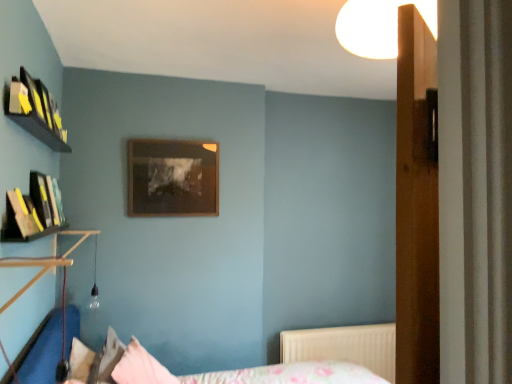
Describe the element at coordinates (292, 374) in the screenshot. This screenshot has height=384, width=512. I see `floral fabric bed at lower center` at that location.

The height and width of the screenshot is (384, 512). What do you see at coordinates (377, 26) in the screenshot?
I see `white glossy light fixture at upper center` at bounding box center [377, 26].

What do you see at coordinates (140, 367) in the screenshot?
I see `pink fabric pillow at lower center, the 2th pillow in the left-to-right sequence` at bounding box center [140, 367].

This screenshot has width=512, height=384. What do you see at coordinates (80, 363) in the screenshot?
I see `fluffy pink pillow at lower left, the 1th pillow when ordered from left to right` at bounding box center [80, 363].

What is the approximate width of yellow paper at upper left?

It is 3.23 inches.

Locate an element on the screen. The width and height of the screenshot is (512, 384). floral fabric bed at lower center is located at coordinates (292, 374).

From the picture: Considering the relative sizes of white glossy light fixture at upper center and pink fabric pillow at lower center, which appears as the 1th pillow when viewed from the right, in the image provided, is white glossy light fixture at upper center taller than pink fabric pillow at lower center, which appears as the 1th pillow when viewed from the right,?

In fact, white glossy light fixture at upper center may be shorter than pink fabric pillow at lower center, which appears as the 1th pillow when viewed from the right.

Which is nearer, (389, 33) or (154, 373)?

Point (389, 33).

Is pink fabric pillow at lower center, which appears as the 1th pillow when viewed from the right, at the back of white glossy light fixture at upper center?

No, white glossy light fixture at upper center is not facing away from pink fabric pillow at lower center, which appears as the 1th pillow when viewed from the right.

Which object is positioned more to the right, white glossy light fixture at upper center or pink fabric pillow at lower center, the 2th pillow in the left-to-right sequence?

white glossy light fixture at upper center.

From the image's perspective, is white glossy light fixture at upper center on top of white textured radiator at lower right?

Yes, from the image's perspective, white glossy light fixture at upper center is on top of white textured radiator at lower right.

Does white glossy light fixture at upper center appear on the right side of white textured radiator at lower right?

No, white glossy light fixture at upper center is not to the right of white textured radiator at lower right.

In terms of size, does white glossy light fixture at upper center appear bigger or smaller than white textured radiator at lower right?

white glossy light fixture at upper center is smaller than white textured radiator at lower right.

Is white glossy light fixture at upper center shorter than white textured radiator at lower right?

Correct, white glossy light fixture at upper center is not as tall as white textured radiator at lower right.

Find the location of a particular element. This screenshot has height=384, width=512. light fixture above the yellow paper at upper left (from a real-world perspective) is located at coordinates 377,26.

Could you tell me if yellow paper at upper left is turned towards white glossy light fixture at upper center?

No, yellow paper at upper left does not turn towards white glossy light fixture at upper center.

Considering the relative sizes of yellow paper at upper left and white glossy light fixture at upper center in the image provided, is yellow paper at upper left smaller than white glossy light fixture at upper center?

Yes.

Is yellow paper at upper left positioned far away from white glossy light fixture at upper center?

Indeed, yellow paper at upper left is not near white glossy light fixture at upper center.

Would you say yellow paper at upper left is a long distance from wooden picture frame at center?

Absolutely, yellow paper at upper left is distant from wooden picture frame at center.

Locate an element on the screen. Image resolution: width=512 pixels, height=384 pixels. book above the wooden picture frame at center (from a real-world perspective) is located at coordinates (19, 98).

Is yellow paper at upper left looking in the opposite direction of wooden picture frame at center?

No, yellow paper at upper left is not facing the opposite direction of wooden picture frame at center.

In the image, is yellow paper at upper left on the left side or the right side of wooden picture frame at center?

Based on their positions, yellow paper at upper left is located to the left of wooden picture frame at center.

At what (x,y) coordinates should I click in order to perform the action: click on book located on the left of white textured radiator at lower right. Please return your answer as a coordinate pair (x, y). Looking at the image, I should click on (19, 98).

From the image's perspective, is yellow paper at upper left positioned above or below white textured radiator at lower right?

yellow paper at upper left is situated higher than white textured radiator at lower right in the image.

Is yellow paper at upper left bigger than white textured radiator at lower right?

Actually, yellow paper at upper left might be smaller than white textured radiator at lower right.

In the scene shown: Considering the sizes of yellow paper at upper left and white textured radiator at lower right in the image, is yellow paper at upper left taller or shorter than white textured radiator at lower right?

Considering their sizes, yellow paper at upper left has less height than white textured radiator at lower right.

Measure the distance between pink fabric pillow at lower center, the 2th pillow in the left-to-right sequence, and white textured radiator at lower right.

1.40 meters.

Is pink fabric pillow at lower center, which appears as the 1th pillow when viewed from the right, aimed at white textured radiator at lower right?

Yes.

In the scene shown: In the image, is pink fabric pillow at lower center, which appears as the 1th pillow when viewed from the right, positioned in front of or behind white textured radiator at lower right?

In the image, pink fabric pillow at lower center, which appears as the 1th pillow when viewed from the right, appears in front of white textured radiator at lower right.

Which is more to the left, pink fabric pillow at lower center, which appears as the 1th pillow when viewed from the right, or wooden picture frame at center?

Positioned to the left is pink fabric pillow at lower center, which appears as the 1th pillow when viewed from the right.

Who is smaller, pink fabric pillow at lower center, the 2th pillow in the left-to-right sequence, or wooden picture frame at center?

wooden picture frame at center is smaller.

Between point (125, 373) and point (196, 167), which one is positioned in front?

Positioned in front is point (125, 373).

Based on the photo, considering the sizes of objects pink fabric pillow at lower center, the 2th pillow in the left-to-right sequence, and wooden picture frame at center in the image provided, who is shorter, pink fabric pillow at lower center, the 2th pillow in the left-to-right sequence, or wooden picture frame at center?

pink fabric pillow at lower center, the 2th pillow in the left-to-right sequence.

Locate an element on the screen. The width and height of the screenshot is (512, 384). light fixture located on the right of pink fabric pillow at lower center, the 2th pillow in the left-to-right sequence is located at coordinates (377, 26).

In the image, there is a white glossy light fixture at upper center. Identify the location of radiator below it (from the image's perspective). This screenshot has width=512, height=384. (344, 346).

Consider the image. From the image, which object appears to be farther from white glossy light fixture at upper center, floral fabric bed at lower center or yellow paper at upper left?

The object further to white glossy light fixture at upper center is floral fabric bed at lower center.

Which object lies nearer to the anchor point yellow paper at upper left, fluffy pink pillow at lower left, which appears as the 2th pillow when viewed from the right, or wooden picture frame at center?

Among the two, wooden picture frame at center is located nearer to yellow paper at upper left.

Based on their spatial positions, is white glossy light fixture at upper center or fluffy pink pillow at lower left, which appears as the 2th pillow when viewed from the right, closer to yellow paper at upper left?

The object closer to yellow paper at upper left is white glossy light fixture at upper center.

When comparing their distances from fluffy pink pillow at lower left, which appears as the 2th pillow when viewed from the right, does yellow paper at upper left or wooden picture frame at center seem further?

Among the two, yellow paper at upper left is located further to fluffy pink pillow at lower left, which appears as the 2th pillow when viewed from the right.

When comparing their distances from floral fabric bed at lower center, does white glossy light fixture at upper center or white textured radiator at lower right seem closer?

white textured radiator at lower right.

Which object lies nearer to the anchor point pink fabric pillow at lower center, the 2th pillow in the left-to-right sequence, fluffy pink pillow at lower left, which appears as the 2th pillow when viewed from the right, or floral fabric bed at lower center?

fluffy pink pillow at lower left, which appears as the 2th pillow when viewed from the right.

When comparing their distances from white glossy light fixture at upper center, does white textured radiator at lower right or yellow paper at upper left seem closer?

The object closer to white glossy light fixture at upper center is yellow paper at upper left.

Considering their positions, is pink fabric pillow at lower center, the 2th pillow in the left-to-right sequence, positioned closer to wooden picture frame at center than white glossy light fixture at upper center?

pink fabric pillow at lower center, the 2th pillow in the left-to-right sequence, is closer to wooden picture frame at center.

This screenshot has width=512, height=384. In order to click on picture frame between white glossy light fixture at upper center and white textured radiator at lower right from front to back in this screenshot , I will do `click(173, 178)`.

Find the location of `pillow between yellow paper at upper left and pink fabric pillow at lower center, the 2th pillow in the left-to-right sequence, in the vertical direction`. pillow between yellow paper at upper left and pink fabric pillow at lower center, the 2th pillow in the left-to-right sequence, in the vertical direction is located at coordinates (80, 363).

Locate an element on the screen. The image size is (512, 384). picture frame between yellow paper at upper left and pink fabric pillow at lower center, which appears as the 1th pillow when viewed from the right, in the up-down direction is located at coordinates tap(173, 178).

You are a GUI agent. You are given a task and a screenshot of the screen. Output one action in this format:
    pyautogui.click(x=<x>, y=<y>)
    Task: Click on the book between white glossy light fixture at upper center and floral fabric bed at lower center from top to bottom
    Image resolution: width=512 pixels, height=384 pixels.
    Given the screenshot: What is the action you would take?
    pyautogui.click(x=19, y=98)